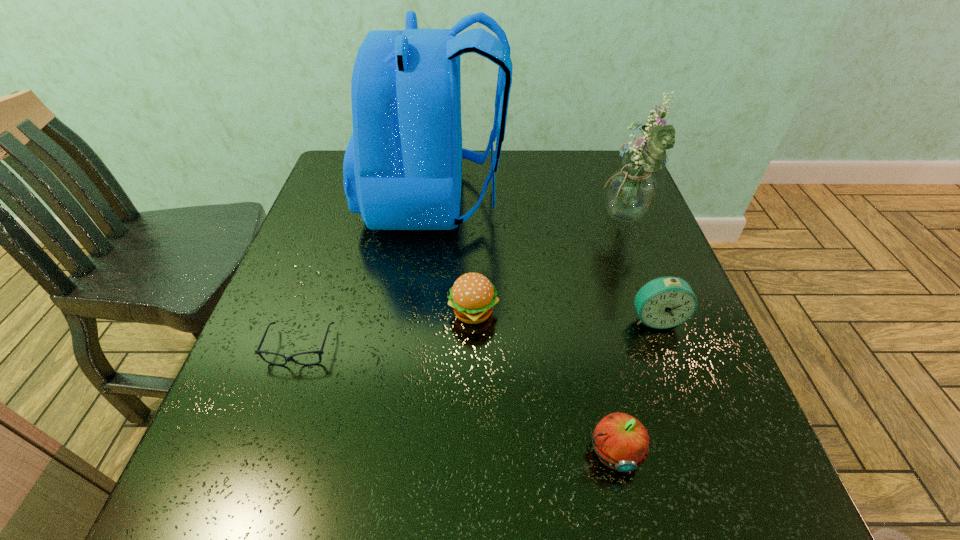
The image size is (960, 540). What are the coordinates of `vacant space that satisfies the following two spatial constraints: 1. on the front-facing side of the shortest object; 2. on the left side of the third object from right to left` in the screenshot? It's located at (263, 452).

You are a GUI agent. You are given a task and a screenshot of the screen. Output one action in this format:
    pyautogui.click(x=<x>, y=<y>)
    Task: Click on the free space that satisfies the following two spatial constraints: 1. on the back of the hamburger; 2. on the right side of the tallest object
    This screenshot has height=540, width=960.
    Given the screenshot: What is the action you would take?
    pyautogui.click(x=420, y=313)